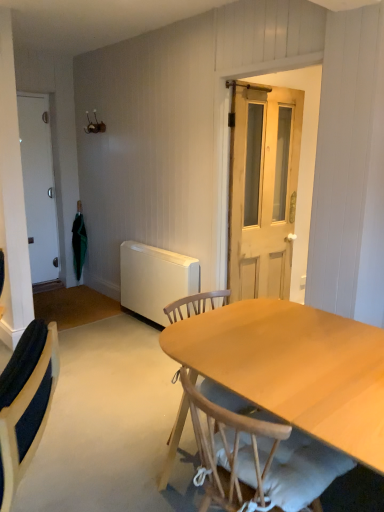
Question: Does wooden chair at center, which is the second chair from left to right, turn towards white matte radiator at lower left?

Choices:
 (A) yes
 (B) no

Answer: (B)

Question: Is wooden chair at center, which is the second chair from left to right, shorter than white matte radiator at lower left?

Choices:
 (A) yes
 (B) no

Answer: (B)

Question: Does wooden chair at center, which is the second chair from left to right, have a greater width compared to white matte radiator at lower left?

Choices:
 (A) no
 (B) yes

Answer: (B)

Question: Does wooden chair at center, which is the 1th chair in right-to-left order, have a smaller size compared to white matte radiator at lower left?

Choices:
 (A) no
 (B) yes

Answer: (A)

Question: Can you confirm if wooden chair at center, which is the second chair from left to right, is thinner than white matte radiator at lower left?

Choices:
 (A) yes
 (B) no

Answer: (B)

Question: Is wooden chair at center, which is the second chair from left to right, at the right side of white matte radiator at lower left?

Choices:
 (A) yes
 (B) no

Answer: (A)

Question: Is the depth of white matte radiator at lower left less than that of light brown wooden door at center, the second door in the back-to-front sequence?

Choices:
 (A) yes
 (B) no

Answer: (B)

Question: Is white matte radiator at lower left far away from light brown wooden door at center, which ranks as the first door in right-to-left order?

Choices:
 (A) no
 (B) yes

Answer: (A)

Question: Does white matte radiator at lower left have a lesser height compared to light brown wooden door at center, which ranks as the first door in right-to-left order?

Choices:
 (A) no
 (B) yes

Answer: (B)

Question: From the image's perspective, would you say white matte radiator at lower left is shown under light brown wooden door at center, the second door in the back-to-front sequence?

Choices:
 (A) no
 (B) yes

Answer: (B)

Question: From a real-world perspective, does white matte radiator at lower left stand above light brown wooden door at center, the second door in the back-to-front sequence?

Choices:
 (A) no
 (B) yes

Answer: (A)

Question: Is light brown wooden door at center, placed as the 2th door when sorted from left to right, a part of white matte radiator at lower left?

Choices:
 (A) yes
 (B) no

Answer: (B)

Question: Is white fabric tablecloth at center smaller than white matte door at left, the second door viewed from the front?

Choices:
 (A) no
 (B) yes

Answer: (A)